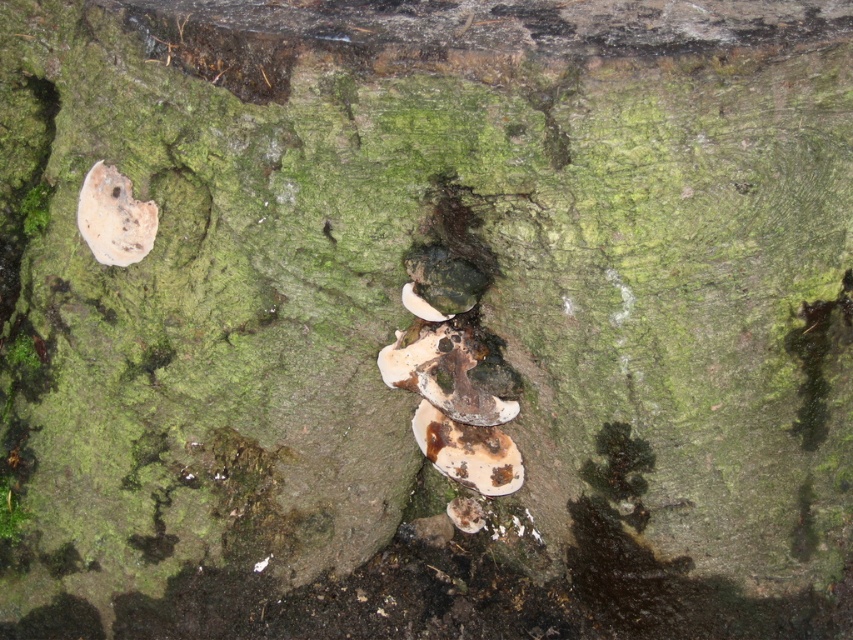
Question: Among these points, which one is nearest to the camera?

Choices:
 (A) (93, 180)
 (B) (490, 442)

Answer: (A)

Question: Is brown textured mushroom at center above white matte mushroom at upper left?

Choices:
 (A) yes
 (B) no

Answer: (B)

Question: Can you confirm if brown textured mushroom at center is positioned to the right of white matte mushroom at upper left?

Choices:
 (A) no
 (B) yes

Answer: (B)

Question: Does brown textured mushroom at center come in front of white matte mushroom at upper left?

Choices:
 (A) no
 (B) yes

Answer: (A)

Question: Among these points, which one is nearest to the camera?

Choices:
 (A) (91, 246)
 (B) (465, 470)

Answer: (A)

Question: Which point is closer to the camera?

Choices:
 (A) (86, 234)
 (B) (457, 460)

Answer: (A)